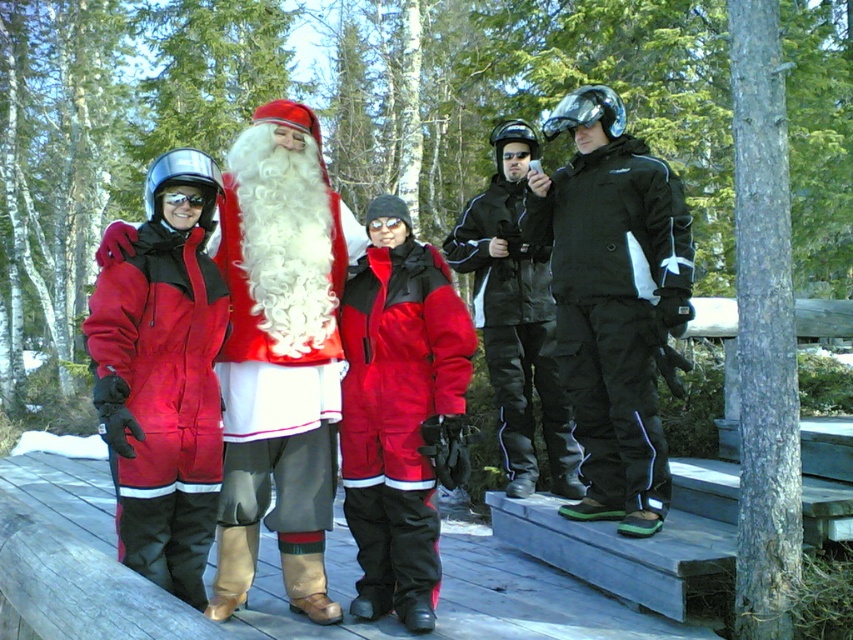
Question: Among these points, which one is nearest to the camera?

Choices:
 (A) (260, 184)
 (B) (444, 404)
 (C) (497, 225)
 (D) (183, 196)

Answer: (D)

Question: Which point appears farthest from the camera in this image?

Choices:
 (A) (599, 323)
 (B) (387, 324)

Answer: (A)

Question: Does matte red snowsuit at center have a lesser width compared to black waterproof jacket at center?

Choices:
 (A) no
 (B) yes

Answer: (B)

Question: Can you confirm if red velvet santa at left is bigger than matte red snowsuit at left?

Choices:
 (A) yes
 (B) no

Answer: (A)

Question: Is red velvet santa at left bigger than matte black ski suit at center?

Choices:
 (A) no
 (B) yes

Answer: (A)

Question: Which point is farther from the camera taking this photo?

Choices:
 (A) (155, 170)
 (B) (235, 310)

Answer: (B)